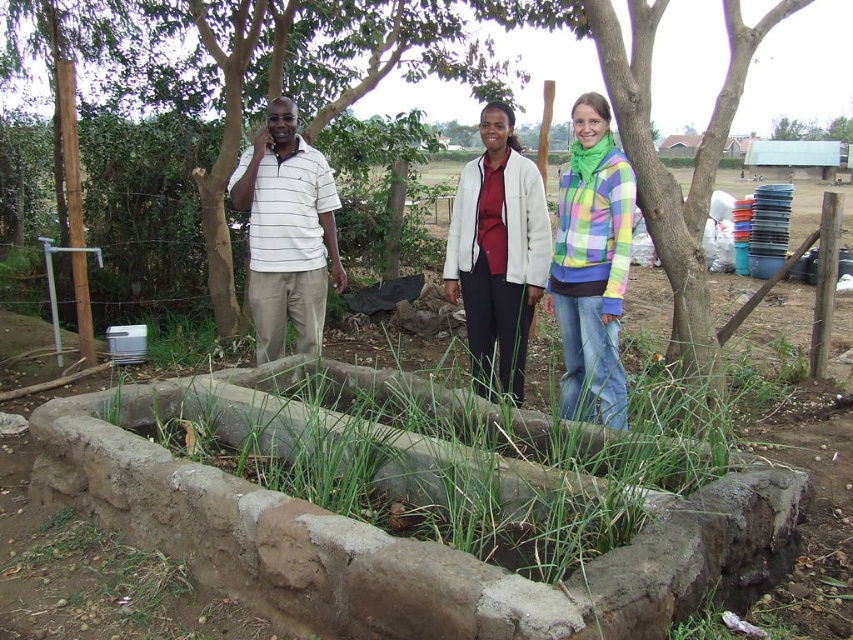
Question: Is white fleece jacket at center to the right of white striped polo shirt at left from the viewer's perspective?

Choices:
 (A) yes
 (B) no

Answer: (A)

Question: Which of these objects is positioned closest to the white striped polo shirt at left?

Choices:
 (A) multicolored plaid jacket at center
 (B) brown bark tree at upper center
 (C) white fleece jacket at center

Answer: (C)

Question: Does multicolored plaid jacket at center appear on the left side of white striped polo shirt at left?

Choices:
 (A) no
 (B) yes

Answer: (A)

Question: Which point is closer to the camera?

Choices:
 (A) (595, 288)
 (B) (102, 42)
 (C) (468, 170)

Answer: (A)

Question: Which of the following is the farthest from the observer?

Choices:
 (A) (598, 211)
 (B) (177, 51)
 (C) (260, 177)

Answer: (B)

Question: Can you confirm if white fleece jacket at center is positioned below white striped polo shirt at left?

Choices:
 (A) no
 (B) yes

Answer: (B)